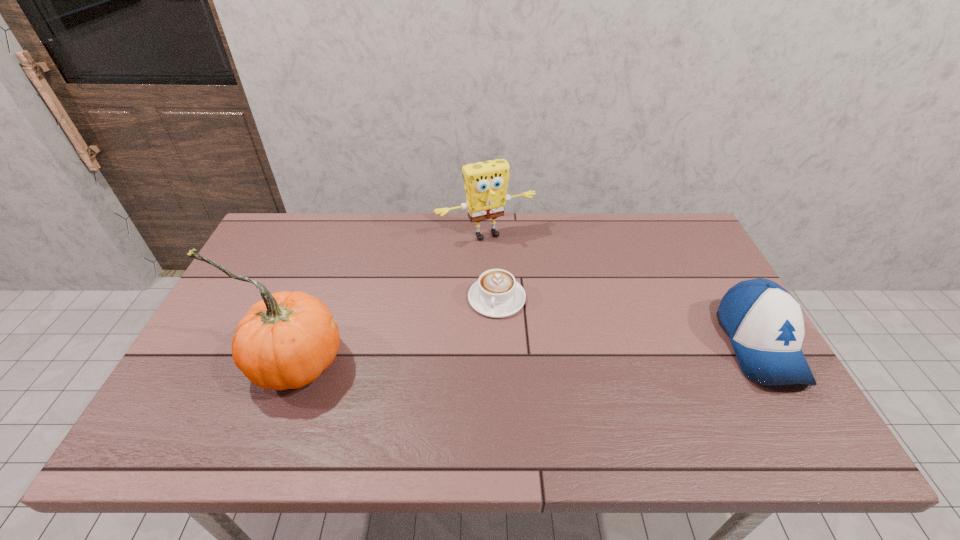
Locate an element on the screen. This screenshot has width=960, height=540. object that is at the near right corner is located at coordinates (764, 322).

Where is `vacant space at the far edge`? This screenshot has width=960, height=540. vacant space at the far edge is located at coordinates (459, 217).

In order to click on vacant region at the near edge of the desktop in this screenshot , I will do `click(530, 400)`.

Find the location of `vacant space at the right edge of the desktop`. vacant space at the right edge of the desktop is located at coordinates (713, 318).

I want to click on vacant space at the far left corner of the desktop, so click(x=313, y=237).

Find the location of a particular element. This screenshot has width=960, height=540. free spot at the far right corner of the desktop is located at coordinates (644, 230).

Where is `free space between the third shortest object and the tallest object`? free space between the third shortest object and the tallest object is located at coordinates (390, 298).

Image resolution: width=960 pixels, height=540 pixels. I want to click on vacant region between the cappuccino and the third tallest object, so click(628, 321).

This screenshot has width=960, height=540. Find the location of `free area in between the cappuccino and the leftmost object`. free area in between the cappuccino and the leftmost object is located at coordinates (396, 329).

I want to click on free space between the baseball cap and the leftmost object, so click(527, 353).